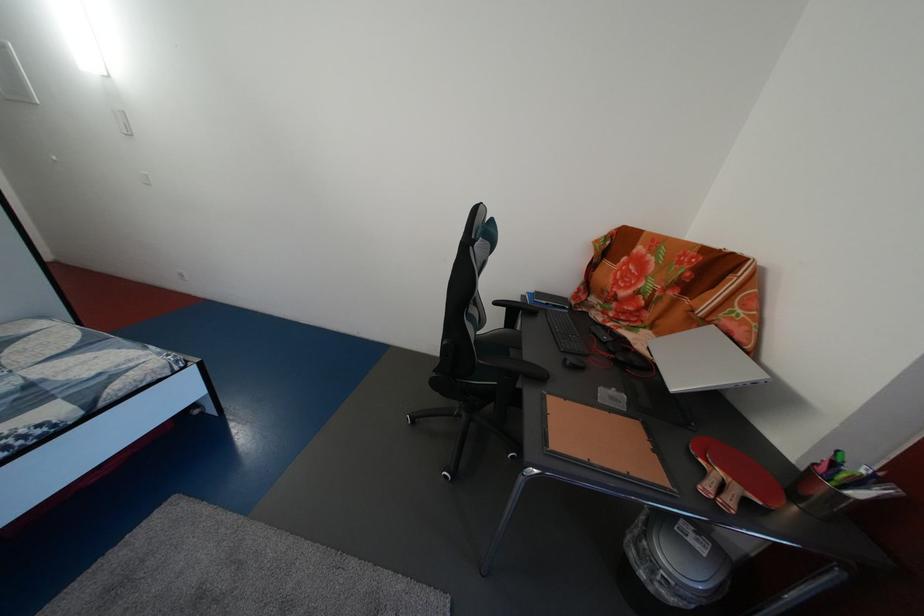
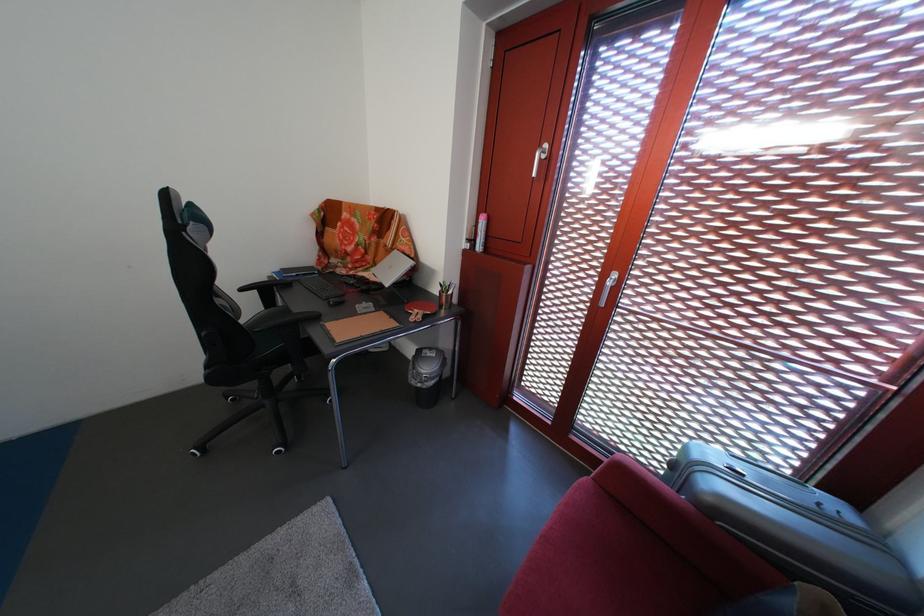
Where in the second image is the point corresponding to (x=520, y=328) from the first image?

(280, 308)